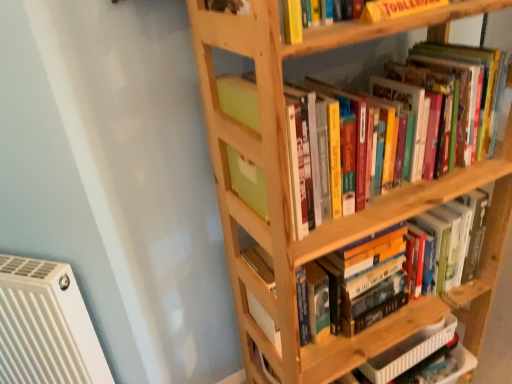
Question: Could you tell me if hardcover book at lower right, the third book from the top, is turned towards yellow cardboard toblerone at upper center?

Choices:
 (A) yes
 (B) no

Answer: (B)

Question: From the image's perspective, is hardcover book at lower right, the third book from the top, on top of yellow cardboard toblerone at upper center?

Choices:
 (A) no
 (B) yes

Answer: (A)

Question: Is hardcover book at lower right, the 1th book ordered from the bottom, with yellow cardboard toblerone at upper center?

Choices:
 (A) yes
 (B) no

Answer: (B)

Question: Can you confirm if hardcover book at lower right, the third book from the top, is positioned to the left of yellow cardboard toblerone at upper center?

Choices:
 (A) no
 (B) yes

Answer: (A)

Question: Can we say hardcover book at lower right, the 1th book ordered from the bottom, lies outside yellow cardboard toblerone at upper center?

Choices:
 (A) no
 (B) yes

Answer: (B)

Question: From the image's perspective, is yellow cardboard toblerone at upper center located above or below hardcover book at lower right, the 1th book ordered from the bottom?

Choices:
 (A) below
 (B) above

Answer: (B)

Question: Is point (399, 13) closer or farther from the camera than point (420, 349)?

Choices:
 (A) farther
 (B) closer

Answer: (B)

Question: Relative to hardcover book at lower right, the third book from the top, is yellow cardboard toblerone at upper center in front or behind?

Choices:
 (A) behind
 (B) front

Answer: (B)

Question: Is yellow cardboard toblerone at upper center situated inside hardcover book at lower right, the 1th book ordered from the bottom, or outside?

Choices:
 (A) inside
 (B) outside

Answer: (B)

Question: Is natural wood bookshelf at upper right wider or thinner than hardcover book at lower right, the 1th book ordered from the bottom?

Choices:
 (A) thin
 (B) wide

Answer: (B)

Question: From the image's perspective, relative to hardcover book at lower right, the third book from the top, is natural wood bookshelf at upper right above or below?

Choices:
 (A) above
 (B) below

Answer: (A)

Question: From a real-world perspective, is natural wood bookshelf at upper right above or below hardcover book at lower right, the 1th book ordered from the bottom?

Choices:
 (A) above
 (B) below

Answer: (A)

Question: Choose the correct answer: Is natural wood bookshelf at upper right inside hardcover book at lower right, the 1th book ordered from the bottom, or outside it?

Choices:
 (A) outside
 (B) inside

Answer: (A)

Question: Is point (12, 263) positioned closer to the camera than point (407, 9)?

Choices:
 (A) closer
 (B) farther

Answer: (B)

Question: From their relative heights in the image, would you say white plastic radiator at lower left is taller or shorter than yellow cardboard toblerone at upper center?

Choices:
 (A) tall
 (B) short

Answer: (A)